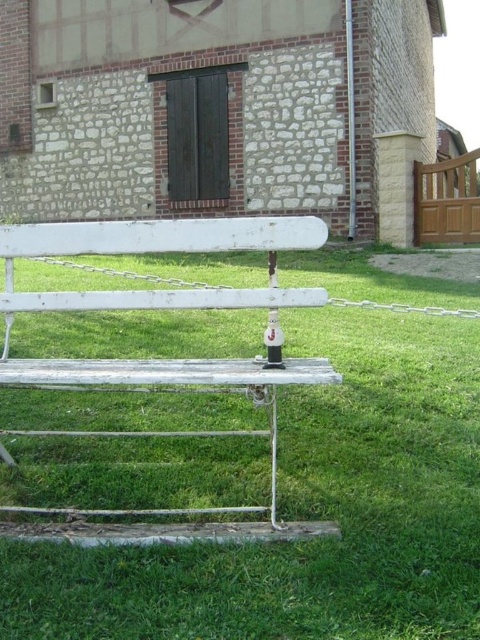
Does green grass at center have a smaller size compared to white painted wood park bench at center?

No.

Can you confirm if green grass at center is wider than white painted wood park bench at center?

Indeed, green grass at center has a greater width compared to white painted wood park bench at center.

What do you see at coordinates (311, 512) in the screenshot? The image size is (480, 640). I see `green grass at center` at bounding box center [311, 512].

Where is `green grass at center`? green grass at center is located at coordinates (311, 512).